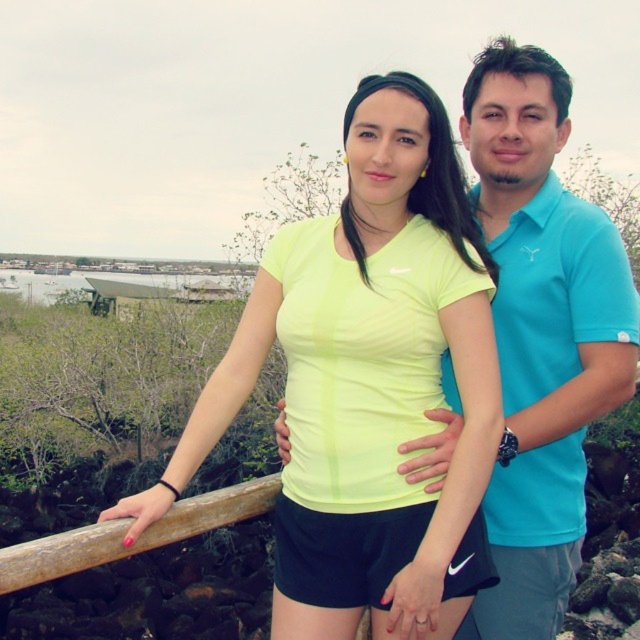
Who is more distant from viewer, (417,548) or (120,522)?

The point (417,548) is behind.

Image resolution: width=640 pixels, height=640 pixels. What do you see at coordinates (365, 381) in the screenshot? I see `neon yellow fabric at center` at bounding box center [365, 381].

This screenshot has width=640, height=640. What are the coordinates of `neon yellow fabric at center` in the screenshot? It's located at (365, 381).

Which of these two, neon yellow fabric at center or matte blue polo shirt at center, stands taller?

With more height is matte blue polo shirt at center.

How much distance is there between neon yellow fabric at center and matte blue polo shirt at center?

neon yellow fabric at center and matte blue polo shirt at center are 24.89 inches apart.

This screenshot has width=640, height=640. What are the coordinates of `neon yellow fabric at center` in the screenshot? It's located at 365,381.

Between matte blue polo shirt at center and wooden at left, which one has more height?

matte blue polo shirt at center is taller.

At what (x,y) coordinates should I click in order to perform the action: click on matte blue polo shirt at center. Please return your answer as a coordinate pair (x, y). Image resolution: width=640 pixels, height=640 pixels. Looking at the image, I should click on (541, 333).